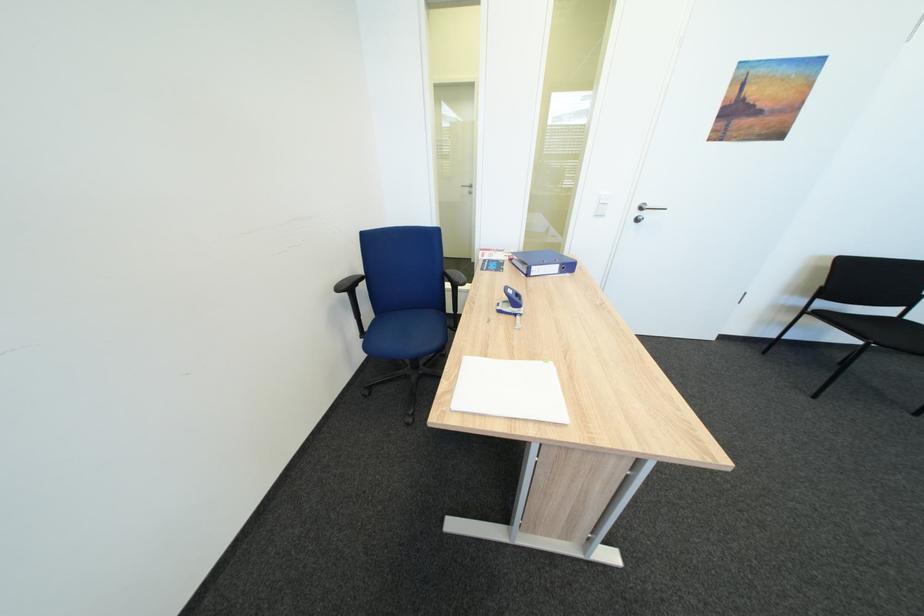
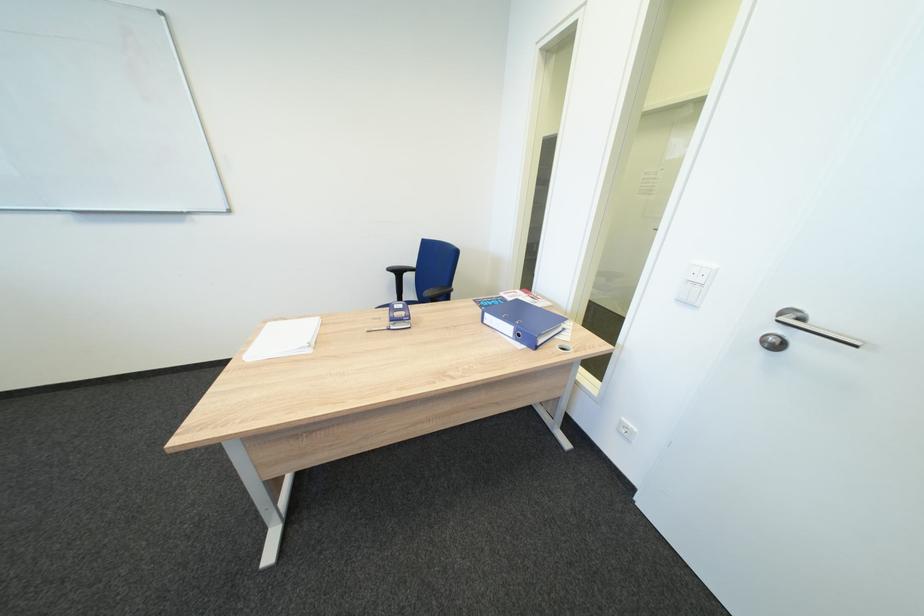
The point at [648,222] is marked in the first image. Where is the corresponding point in the second image?

(784, 346)